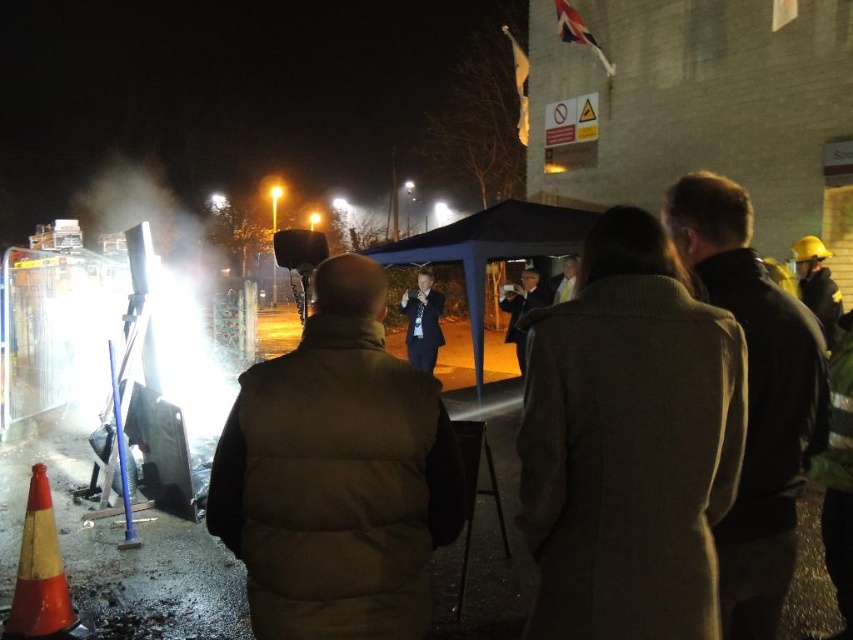
You are a photographer standing at the back of the crowd. You want to take a photo of the brown puffer vest at center without anyone blocking it. The two people on the right are 1.89 meters apart. Can you estimate if there is enough space between them to frame the vest clearly?

The two people on the right are 1.89 meters apart, which provides sufficient space to position yourself between them and capture the brown puffer vest at center without obstruction.

You are standing at the back of the crowd in the nighttime scene. You want to locate the brown puffer vest at center and the orange reflective cone at lower left. Based on their positions, which object is higher up in the image?

The brown puffer vest at center is above the orange reflective cone at lower left in the image.